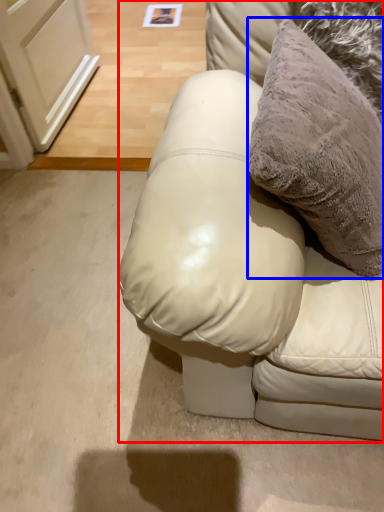
Question: Which point is closer to the camera, furniture (highlighted by a red box) or pillow (highlighted by a blue box)?

Choices:
 (A) furniture
 (B) pillow

Answer: (A)